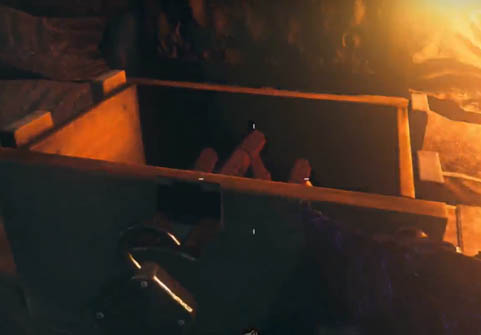
Where is `wooden box`? wooden box is located at coordinates (111, 134).